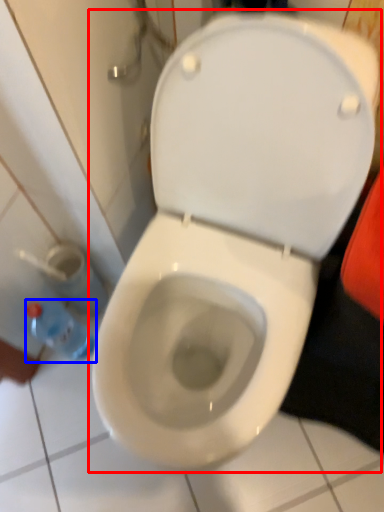
Question: Which object appears farthest to the camera in this image, toilet (highlighted by a red box) or bottle (highlighted by a blue box)?

Choices:
 (A) toilet
 (B) bottle

Answer: (B)